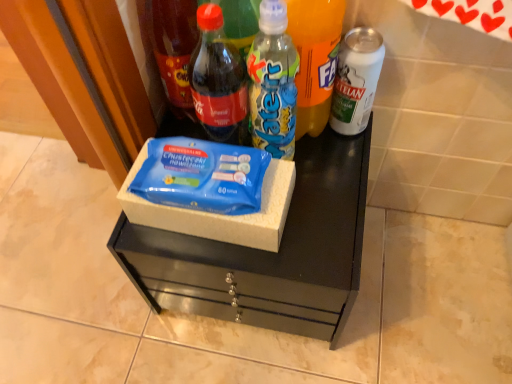
Question: Is blue cardboard box at center at the right side of blue matte wipes at center?

Choices:
 (A) no
 (B) yes

Answer: (A)

Question: Considering the relative positions of blue cardboard box at center and blue matte wipes at center in the image provided, is blue cardboard box at center behind blue matte wipes at center?

Choices:
 (A) yes
 (B) no

Answer: (B)

Question: Considering the relative sizes of blue cardboard box at center and blue matte wipes at center in the image provided, is blue cardboard box at center wider than blue matte wipes at center?

Choices:
 (A) no
 (B) yes

Answer: (A)

Question: Can you confirm if blue cardboard box at center is thinner than blue matte wipes at center?

Choices:
 (A) yes
 (B) no

Answer: (A)

Question: Is blue cardboard box at center to the left of blue matte wipes at center from the viewer's perspective?

Choices:
 (A) yes
 (B) no

Answer: (A)

Question: Is blue cardboard box at center outside of blue matte wipes at center?

Choices:
 (A) yes
 (B) no

Answer: (A)

Question: Is white matte can at right, the fifth bottle viewed from the left, placed right next to blue matte wipes at center?

Choices:
 (A) yes
 (B) no

Answer: (B)

Question: Does white matte can at right, marked as the 1th bottle in a right-to-left arrangement, appear on the left side of blue matte wipes at center?

Choices:
 (A) yes
 (B) no

Answer: (B)

Question: Is white matte can at right, the fifth bottle viewed from the left, bigger than blue matte wipes at center?

Choices:
 (A) no
 (B) yes

Answer: (A)

Question: Is white matte can at right, the fifth bottle viewed from the left, turned away from blue matte wipes at center?

Choices:
 (A) yes
 (B) no

Answer: (B)

Question: Can you confirm if white matte can at right, the fifth bottle viewed from the left, is thinner than blue matte wipes at center?

Choices:
 (A) no
 (B) yes

Answer: (B)

Question: Considering the relative positions of white matte can at right, the fifth bottle viewed from the left, and blue matte wipes at center in the image provided, is white matte can at right, the fifth bottle viewed from the left, behind blue matte wipes at center?

Choices:
 (A) yes
 (B) no

Answer: (A)

Question: Is translucent plastic water bottle at center, the 3th bottle from the left, shorter than matte glass bottle at upper left, which ranks as the first bottle in left-to-right order?

Choices:
 (A) yes
 (B) no

Answer: (A)